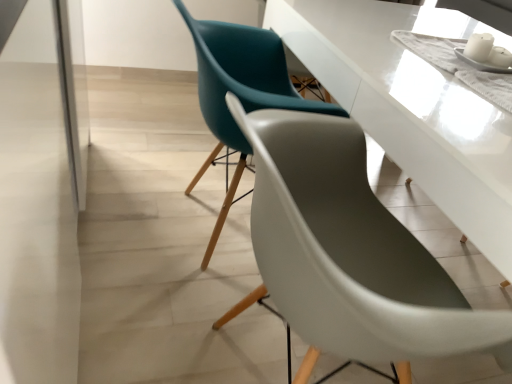
Question: Can you confirm if matte teal chair at center, the second chair from the front, is smaller than transparent glass door at left?

Choices:
 (A) no
 (B) yes

Answer: (B)

Question: From a real-world perspective, is matte teal chair at center, the second chair from the front, under transparent glass door at left?

Choices:
 (A) yes
 (B) no

Answer: (A)

Question: Is matte teal chair at center, the second chair from the front, facing towards transparent glass door at left?

Choices:
 (A) no
 (B) yes

Answer: (A)

Question: Is matte teal chair at center, the second chair from the front, surrounding transparent glass door at left?

Choices:
 (A) yes
 (B) no

Answer: (B)

Question: From the image's perspective, does matte teal chair at center, the second chair from the front, appear lower than transparent glass door at left?

Choices:
 (A) no
 (B) yes

Answer: (A)

Question: Looking at the image, does transparent glass door at left seem bigger or smaller compared to matte teal chair at center, acting as the 2th chair starting from the back?

Choices:
 (A) small
 (B) big

Answer: (B)

Question: In the image, is transparent glass door at left positioned in front of or behind matte teal chair at center, placed as the first chair when sorted from front to back?

Choices:
 (A) front
 (B) behind

Answer: (A)

Question: From the image's perspective, is transparent glass door at left located above or below matte teal chair at center, placed as the first chair when sorted from front to back?

Choices:
 (A) below
 (B) above

Answer: (B)

Question: Would you say transparent glass door at left is inside or outside matte teal chair at center, placed as the first chair when sorted from front to back?

Choices:
 (A) outside
 (B) inside

Answer: (A)

Question: Is point (68, 170) positioned closer to the camera than point (200, 29)?

Choices:
 (A) farther
 (B) closer

Answer: (B)

Question: Is transparent glass door at left taller or shorter than matte teal chair at center, acting as the first chair starting from the back?

Choices:
 (A) short
 (B) tall

Answer: (B)

Question: From a real-world perspective, is transparent glass door at left physically located above or below matte teal chair at center, the second chair from the front?

Choices:
 (A) below
 (B) above

Answer: (B)

Question: Looking at the image, does transparent glass door at left seem bigger or smaller compared to matte teal chair at center, the second chair from the front?

Choices:
 (A) small
 (B) big

Answer: (B)

Question: Is matte teal chair at center, the second chair from the front, inside the boundaries of matte teal chair at center, placed as the first chair when sorted from front to back, or outside?

Choices:
 (A) inside
 (B) outside

Answer: (B)

Question: In the image, is matte teal chair at center, the second chair from the front, positioned in front of or behind matte teal chair at center, acting as the 2th chair starting from the back?

Choices:
 (A) front
 (B) behind

Answer: (B)